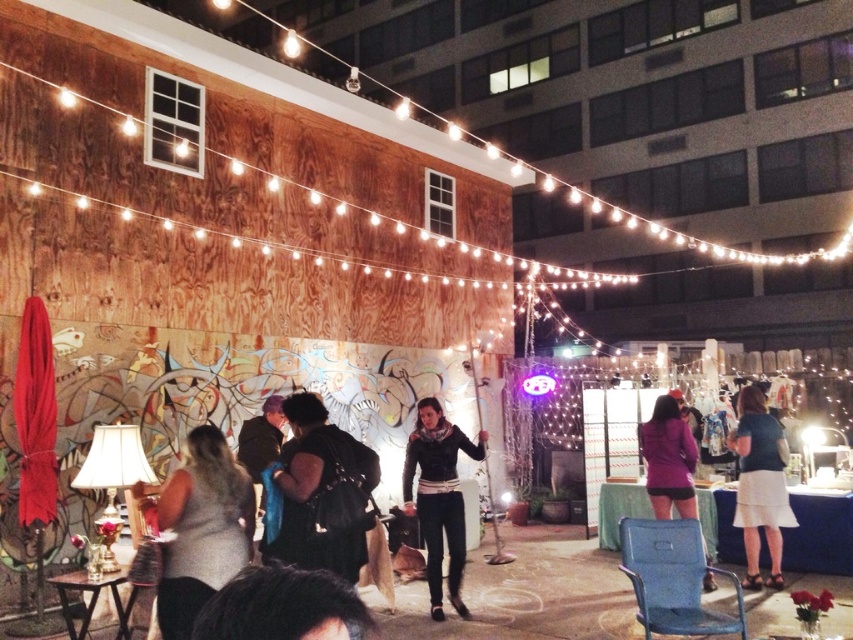
Question: Is black leather jacket at center below purple matte jacket at center?

Choices:
 (A) no
 (B) yes

Answer: (B)

Question: Which point is farther from the camera taking this photo?

Choices:
 (A) (321, 515)
 (B) (756, 416)

Answer: (B)

Question: Does matte black dress at lower left appear under dark brown hair at lower center?

Choices:
 (A) yes
 (B) no

Answer: (A)

Question: Which of these objects is positioned closest to the black leather jacket at center?

Choices:
 (A) matte black dress at lower left
 (B) purple matte jacket at center
 (C) dark brown hair at lower center

Answer: (B)

Question: Does black matte jacket at center appear under matte black dress at lower left?

Choices:
 (A) yes
 (B) no

Answer: (B)

Question: Among these points, which one is farthest from the camera?

Choices:
 (A) (318, 564)
 (B) (747, 529)
 (C) (403, 492)

Answer: (B)